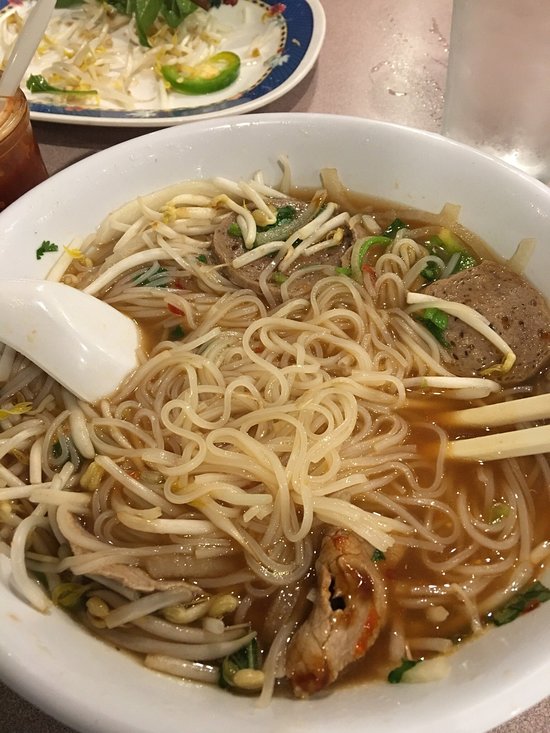
Locate an element on the screen. The width and height of the screenshot is (550, 733). dish is located at coordinates (287, 388), (104, 51).